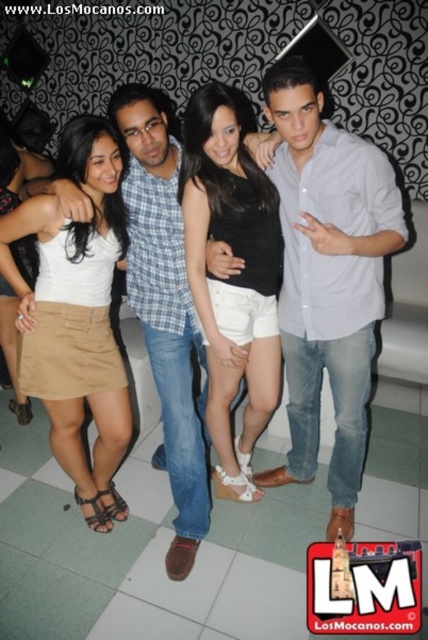
Question: Which object is positioned closest to the black matte shorts at center?

Choices:
 (A) light blue shirt at center
 (B) matte khaki skirt at center

Answer: (A)

Question: Estimate the real-world distances between objects in this image. Which object is closer to the light blue shirt at center?

Choices:
 (A) matte khaki skirt at center
 (B) black matte shorts at center

Answer: (B)

Question: Among these points, which one is nearest to the camera?

Choices:
 (A) (228, 216)
 (B) (394, 172)

Answer: (A)

Question: Can you confirm if black matte shorts at center is thinner than matte khaki skirt at center?

Choices:
 (A) no
 (B) yes

Answer: (B)

Question: Can you confirm if black matte shorts at center is positioned to the left of matte khaki skirt at center?

Choices:
 (A) yes
 (B) no

Answer: (B)

Question: Observing the image, what is the correct spatial positioning of light blue shirt at center in reference to matte khaki skirt at center?

Choices:
 (A) left
 (B) right

Answer: (B)